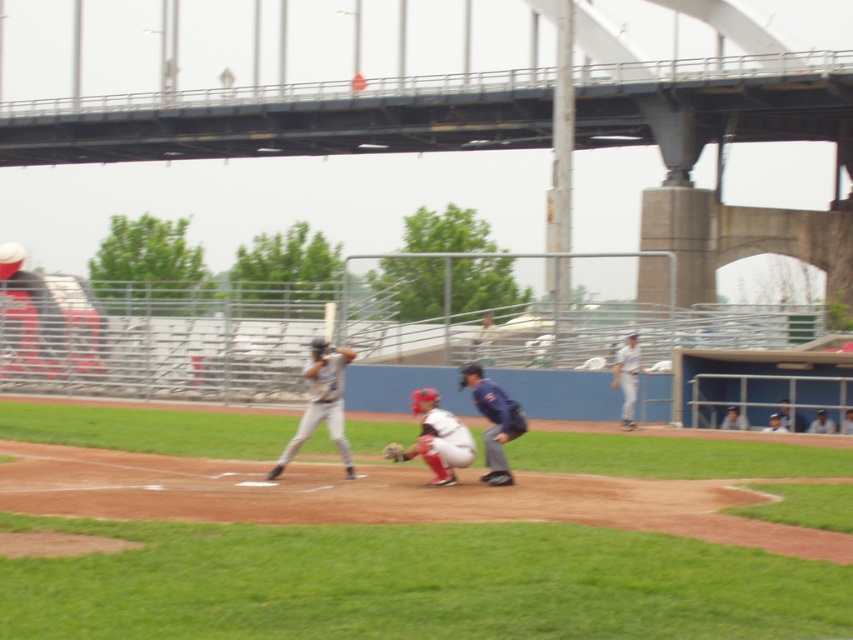
You are a photographer positioned at the center of the baseball field. You want to take a photo that includes both the batter and the catcher. The batter is located at point (x=338, y=410) and the catcher is at point (x=393, y=456). Which of these points is closer to you, the photographer, so you can frame them properly?

Point (x=338, y=410) is closer to you than point (x=393, y=456) because it is further to the viewer, meaning it is positioned nearer in the scene.

You are a photographer capturing the baseball game. You want to ensure both the gray matte uniform at center and the brown leather glove at center are clearly visible in your shot. Which object should you focus on to ensure it appears larger in the photo?

The gray matte uniform at center is larger in size than the brown leather glove at center, so focusing on the gray matte uniform at center will ensure it appears larger in the photo.